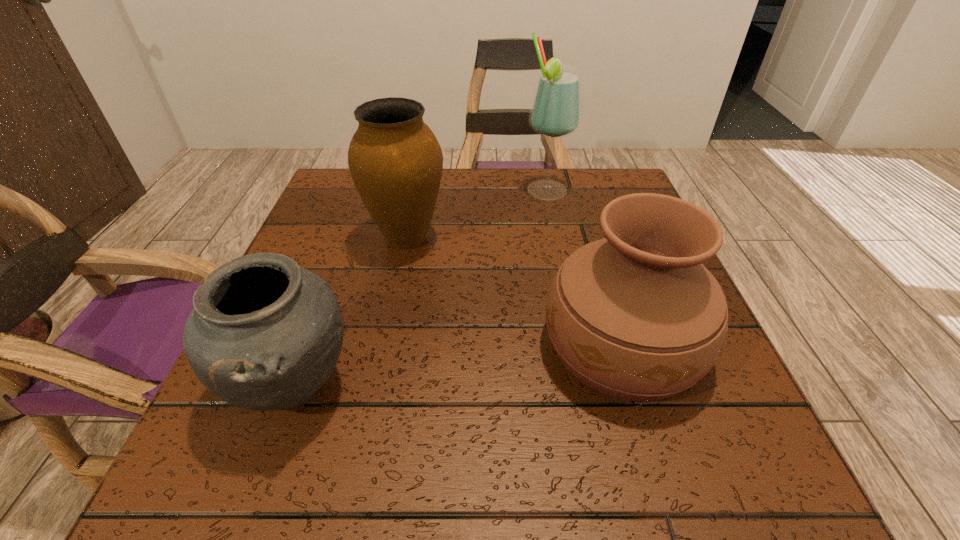
You are a GUI agent. You are given a task and a screenshot of the screen. Output one action in this format:
    pyautogui.click(x=<x>, y=<y>)
    Task: Click on the vacant region between the second farthest object and the rightmost urn
    This screenshot has height=540, width=960.
    Given the screenshot: What is the action you would take?
    pyautogui.click(x=515, y=292)

Find the location of a particular element. Image resolution: width=960 pixels, height=540 pixels. vacant area that lies between the rightmost urn and the farthest urn is located at coordinates (515, 292).

This screenshot has height=540, width=960. I want to click on free space between the rightmost urn and the third nearest object, so [x=515, y=292].

Select which object is the closest to the farthest urn. Please provide its 2D coordinates. Your answer should be formatted as a tuple, i.e. [(x, y)], where the tuple contains the x and y coordinates of a point satisfying the conditions above.

[(556, 111)]

Select which object is the second closest to the farthest urn. Please provide its 2D coordinates. Your answer should be formatted as a tuple, i.e. [(x, y)], where the tuple contains the x and y coordinates of a point satisfying the conditions above.

[(264, 334)]

The image size is (960, 540). What are the coordinates of `urn that is the nearest to the shortest object` in the screenshot? It's located at (396, 163).

Select which urn appears as the closest to the farthest urn. Please provide its 2D coordinates. Your answer should be formatted as a tuple, i.e. [(x, y)], where the tuple contains the x and y coordinates of a point satisfying the conditions above.

[(264, 334)]

Locate an element on the screen. This screenshot has height=540, width=960. free location that satisfies the following two spatial constraints: 1. on the back side of the shortest object; 2. on the right side of the second farthest object is located at coordinates (348, 238).

Where is `free location that satisfies the following two spatial constraints: 1. on the front side of the farthest urn; 2. on the right side of the rightmost urn`? The width and height of the screenshot is (960, 540). free location that satisfies the following two spatial constraints: 1. on the front side of the farthest urn; 2. on the right side of the rightmost urn is located at coordinates (385, 345).